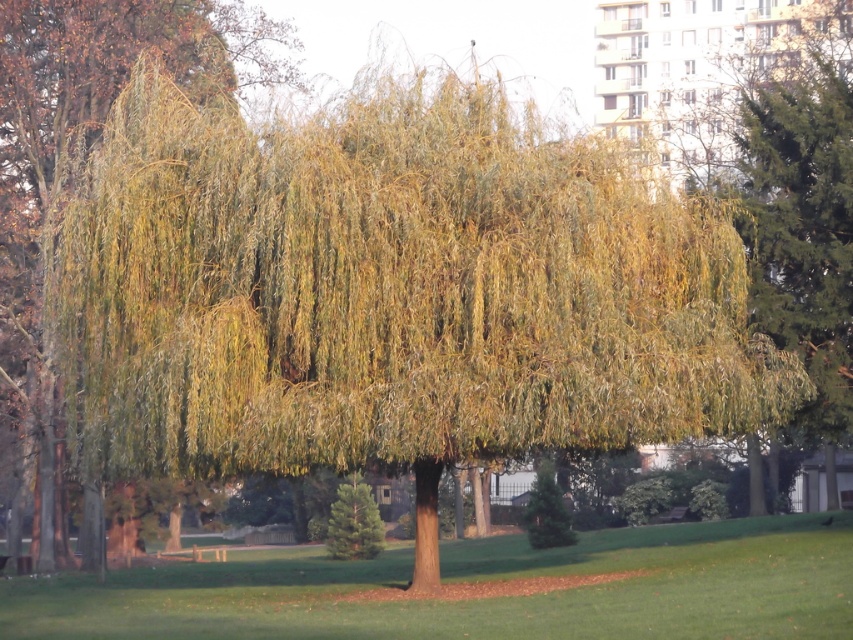
Does green grass at center lie in front of yellow-green leafy tree at right?

That is True.

This screenshot has height=640, width=853. Find the location of `green grass at center`. green grass at center is located at coordinates (477, 580).

Identify the location of green grass at center. Image resolution: width=853 pixels, height=640 pixels. (477, 580).

Which is above, green leafy tree at center or yellow-green leafy tree at right?

Positioned higher is yellow-green leafy tree at right.

Consider the image. Who is lower down, green leafy tree at center or yellow-green leafy tree at right?

green leafy tree at center is lower down.

Where is `green leafy tree at center`? The height and width of the screenshot is (640, 853). green leafy tree at center is located at coordinates (84, 163).

Between green grass at center and green leafy tree at center, which one has more height?

Standing taller between the two is green leafy tree at center.

Which is more to the left, green grass at center or green leafy tree at center?

Positioned to the left is green leafy tree at center.

Find the location of `green grass at center`. green grass at center is located at coordinates (477, 580).

You are a GUI agent. You are given a task and a screenshot of the screen. Output one action in this format:
    pyautogui.click(x=<x>, y=<y>)
    Task: Click on the green grass at center
    
    Given the screenshot: What is the action you would take?
    click(477, 580)